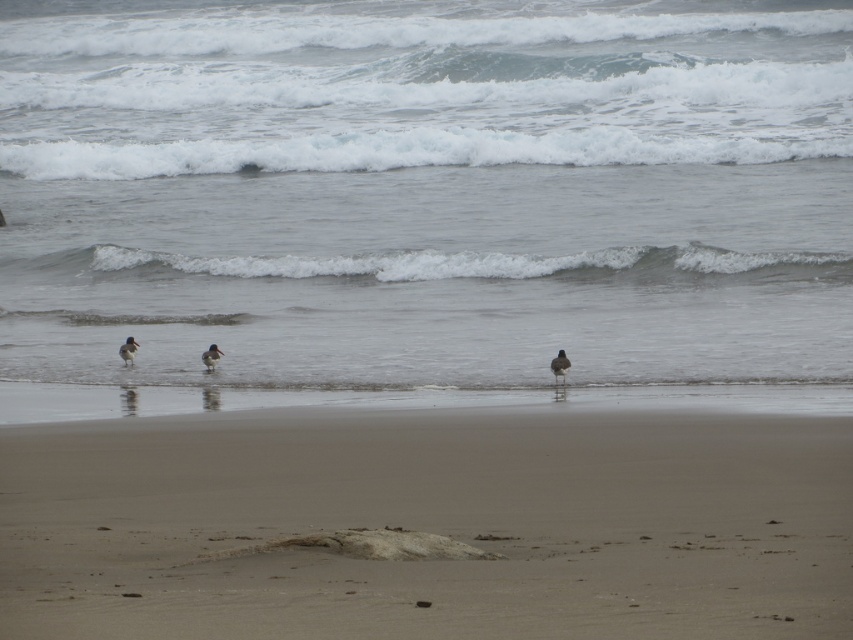
Describe the element at coordinates (426, 192) in the screenshot. I see `gray matte water at center` at that location.

Is gray matte water at center thinner than brown speckled feathered bird at center?

No, gray matte water at center is not thinner than brown speckled feathered bird at center.

Identify the location of gray matte water at center. This screenshot has width=853, height=640. (426, 192).

This screenshot has height=640, width=853. I want to click on smooth sand at lower center, so click(x=428, y=525).

Which is behind, point (312, 476) or point (218, 348)?

Point (218, 348)

Between point (291, 570) and point (202, 358), which one is positioned in front?

Point (291, 570) is more forward.

Where is `smooth sand at lower center`? The width and height of the screenshot is (853, 640). smooth sand at lower center is located at coordinates (428, 525).

Is brown speckled feather at center above brown speckled beak at left?

Incorrect, brown speckled feather at center is not positioned above brown speckled beak at left.

Between brown speckled feather at center and brown speckled beak at left, which one is positioned higher?

brown speckled beak at left is above.

Where is `brown speckled feather at center`? Image resolution: width=853 pixels, height=640 pixels. brown speckled feather at center is located at coordinates (560, 365).

At what (x,y) coordinates should I click in order to perform the action: click on brown speckled feather at center. Please return your answer as a coordinate pair (x, y). Looking at the image, I should click on (560, 365).